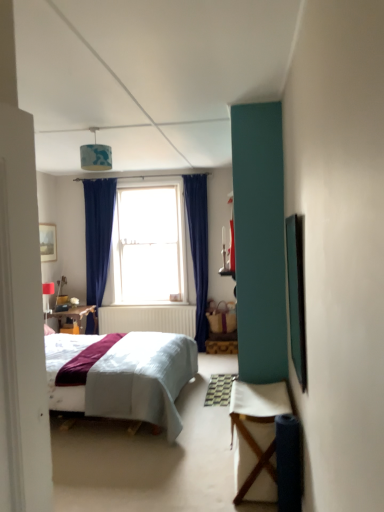
Question: In terms of width, does matte white lampshade at upper left, which is the first lamp from left to right, look wider or thinner when compared to clear glass window at center?

Choices:
 (A) wide
 (B) thin

Answer: (B)

Question: From a real-world perspective, relative to clear glass window at center, is matte white lampshade at upper left, arranged as the second lamp when viewed from the right, vertically above or below?

Choices:
 (A) above
 (B) below

Answer: (B)

Question: Which object is positioned closest to the white fabric table at lower right?

Choices:
 (A) matte white lampshade at upper left, the first lamp positioned from the back
 (B) clear glass window at center
 (C) blue fabric lampshade at upper center, acting as the second lamp starting from the left
 (D) wooden framed picture at upper left

Answer: (C)

Question: Which of these objects is positioned closest to the wooden framed picture at upper left?

Choices:
 (A) clear glass window at center
 (B) matte white lampshade at upper left, arranged as the second lamp when viewed from the right
 (C) blue fabric lampshade at upper center, the first lamp from the top
 (D) white fabric table at lower right

Answer: (B)